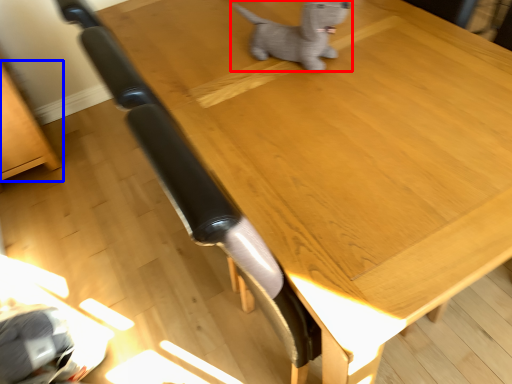
Question: Among these objects, which one is nearest to the camera, dog (highlighted by a red box) or furniture (highlighted by a blue box)?

Choices:
 (A) dog
 (B) furniture

Answer: (A)